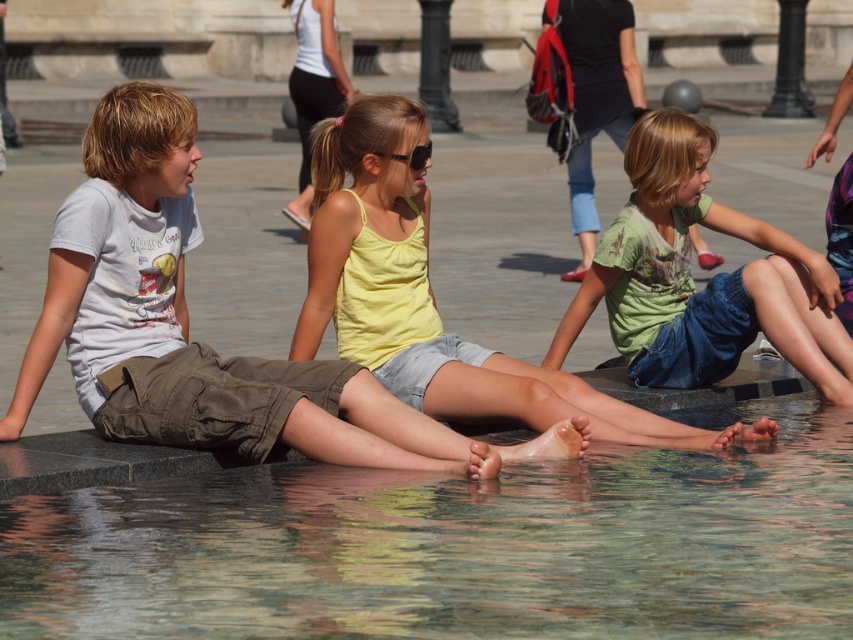
In the scene shown: Is clear glass water at lower center wider than green cotton shirt at center?

Yes.

Locate an element on the screen. clear glass water at lower center is located at coordinates (457, 547).

Is clear glass water at lower center thinner than light brown cotton shorts at center?

Incorrect, clear glass water at lower center's width is not less than light brown cotton shorts at center's.

Can you confirm if clear glass water at lower center is smaller than light brown cotton shorts at center?

Yes, clear glass water at lower center is smaller than light brown cotton shorts at center.

I want to click on clear glass water at lower center, so click(x=457, y=547).

Who is shorter, clear glass water at lower center or yellow cotton tank top at center?

clear glass water at lower center is shorter.

Between point (590, 532) and point (453, 355), which one is positioned behind?

The point (453, 355) is more distant.

Is point (584, 536) farther from viewer compared to point (502, 404)?

No, it is in front of (502, 404).

Where is `clear glass water at lower center`? This screenshot has height=640, width=853. clear glass water at lower center is located at coordinates (457, 547).